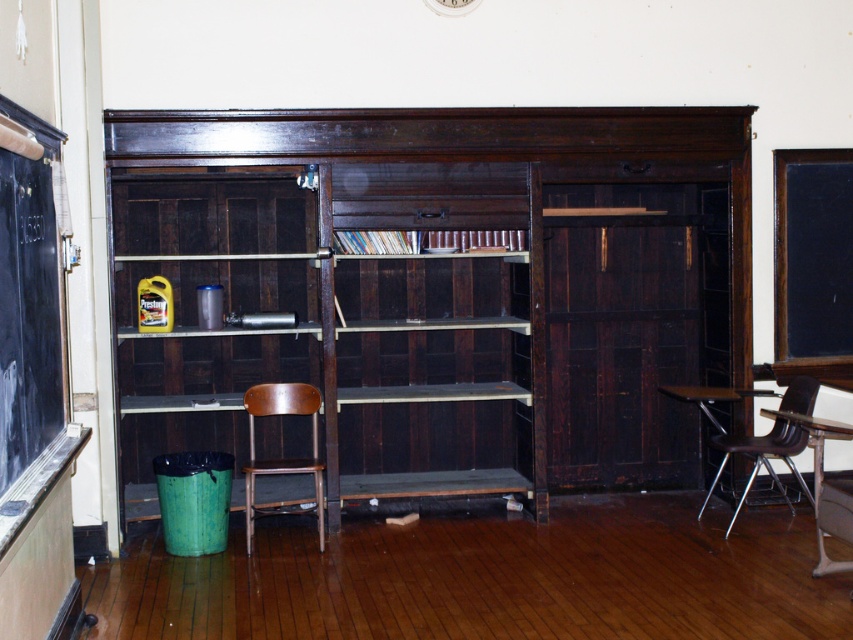
Measure the distance between metallic silver shelf at center and metallic brown table at right.

metallic silver shelf at center is 5.32 feet from metallic brown table at right.

Can you confirm if metallic silver shelf at center is positioned to the right of metallic brown table at right?

No, metallic silver shelf at center is not to the right of metallic brown table at right.

Which is in front, point (479, 320) or point (726, 390)?

Point (726, 390) is in front.

Identify the location of metallic silver shelf at center. (474, 323).

Which of these two, wooden desk at lower right or metallic brown table at right, stands shorter?

wooden desk at lower right

Is wooden desk at lower right further to the viewer compared to metallic brown table at right?

No, it is in front of metallic brown table at right.

Does point (851, 426) come in front of point (733, 396)?

Yes, it is.

What are the coordinates of `wooden desk at lower right` in the screenshot? It's located at (824, 484).

Locate an element on the screen. The width and height of the screenshot is (853, 640). metallic brown chair at right is located at coordinates (761, 458).

Which is in front, point (811, 400) or point (756, 396)?

Point (811, 400)

Identify the location of metallic brown chair at right. The image size is (853, 640). point(761,458).